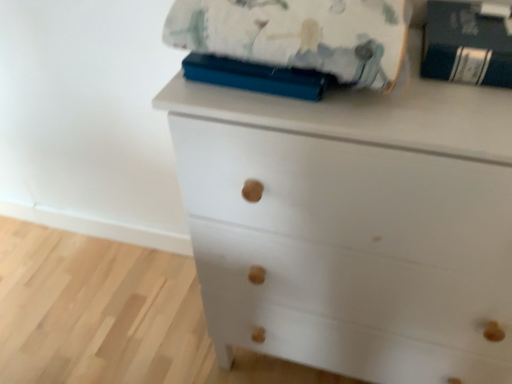
This screenshot has width=512, height=384. I want to click on fluffy cotton blanket at upper center, so [x=301, y=35].

Describe the element at coordinates (465, 46) in the screenshot. I see `dark blue hardcover book at upper right` at that location.

Image resolution: width=512 pixels, height=384 pixels. In order to click on white matte chest of drawers at center in this screenshot , I will do `click(353, 225)`.

From the picture: Which of these two, dark blue hardcover book at upper right or fluffy cotton blanket at upper center, stands shorter?

With less height is dark blue hardcover book at upper right.

From the image's perspective, who appears lower, dark blue hardcover book at upper right or fluffy cotton blanket at upper center?

dark blue hardcover book at upper right is shown below in the image.

Is dark blue hardcover book at upper right placed right next to fluffy cotton blanket at upper center?

No, dark blue hardcover book at upper right is not making contact with fluffy cotton blanket at upper center.

Between dark blue hardcover book at upper right and fluffy cotton blanket at upper center, which one has smaller width?

dark blue hardcover book at upper right is thinner.

How many degrees apart are the facing directions of white matte chest of drawers at center and dark blue hardcover book at upper right?

There is a 0.000221-degree angle between the facing directions of white matte chest of drawers at center and dark blue hardcover book at upper right.

Between white matte chest of drawers at center and dark blue hardcover book at upper right, which one is positioned in front?

white matte chest of drawers at center.

Is white matte chest of drawers at center next to dark blue hardcover book at upper right?

No.

Does point (385, 373) come closer to viewer compared to point (443, 78)?

No, it is behind (443, 78).

Can you confirm if dark blue hardcover book at upper right is positioned to the left of white matte chest of drawers at center?

No, dark blue hardcover book at upper right is not to the left of white matte chest of drawers at center.

Are dark blue hardcover book at upper right and white matte chest of drawers at center located far from each other?

That's not correct — dark blue hardcover book at upper right is a little close to white matte chest of drawers at center.

Which is closer, (455, 23) or (348, 100)?

Point (348, 100)

In terms of width, does dark blue hardcover book at upper right look wider or thinner when compared to white matte chest of drawers at center?

dark blue hardcover book at upper right is thinner than white matte chest of drawers at center.

Can you confirm if fluffy cotton blanket at upper center is taller than dark blue hardcover book at upper right?

Indeed, fluffy cotton blanket at upper center has a greater height compared to dark blue hardcover book at upper right.

Considering the points (207, 33) and (460, 35), which point is in front, point (207, 33) or point (460, 35)?

Point (207, 33)

Considering the relative sizes of fluffy cotton blanket at upper center and dark blue hardcover book at upper right in the image provided, is fluffy cotton blanket at upper center wider than dark blue hardcover book at upper right?

Indeed, fluffy cotton blanket at upper center has a greater width compared to dark blue hardcover book at upper right.

Can we say fluffy cotton blanket at upper center lies outside dark blue hardcover book at upper right?

Yes, fluffy cotton blanket at upper center is outside of dark blue hardcover book at upper right.

Is white matte chest of drawers at center not inside fluffy cotton blanket at upper center?

Yes, white matte chest of drawers at center is located beyond the bounds of fluffy cotton blanket at upper center.

From their relative heights in the image, would you say white matte chest of drawers at center is taller or shorter than fluffy cotton blanket at upper center?

In the image, white matte chest of drawers at center appears to be taller than fluffy cotton blanket at upper center.

Visually, is white matte chest of drawers at center positioned to the left or to the right of fluffy cotton blanket at upper center?

Clearly, white matte chest of drawers at center is on the right of fluffy cotton blanket at upper center in the image.

From a real-world perspective, is fluffy cotton blanket at upper center physically above white matte chest of drawers at center?

Yes, from a real-world perspective, fluffy cotton blanket at upper center is on top of white matte chest of drawers at center.

In the image, is fluffy cotton blanket at upper center on the left side or the right side of white matte chest of drawers at center?

From the image, it's evident that fluffy cotton blanket at upper center is to the left of white matte chest of drawers at center.

Is white matte chest of drawers at center surrounded by fluffy cotton blanket at upper center?

No, white matte chest of drawers at center is located outside of fluffy cotton blanket at upper center.

You are a GUI agent. You are given a task and a screenshot of the screen. Output one action in this format:
    pyautogui.click(x=<x>, y=<y>)
    Task: Click on the blanket that appears above the white matte chest of drawers at center (from the image's perspective)
    This screenshot has height=384, width=512.
    Given the screenshot: What is the action you would take?
    pyautogui.click(x=301, y=35)

I want to click on paperback book that is behind the fluffy cotton blanket at upper center, so click(x=465, y=46).

What are the coordinates of `paperback book above the white matte chest of drawers at center (from a real-world perspective)` in the screenshot? It's located at point(465,46).

Considering their positions, is dark blue hardcover book at upper right positioned closer to fluffy cotton blanket at upper center than white matte chest of drawers at center?

Based on the image, dark blue hardcover book at upper right appears to be nearer to fluffy cotton blanket at upper center.

In the scene shown: Which object lies nearer to the anchor point white matte chest of drawers at center, dark blue hardcover book at upper right or fluffy cotton blanket at upper center?

The object closer to white matte chest of drawers at center is fluffy cotton blanket at upper center.

Based on their spatial positions, is fluffy cotton blanket at upper center or white matte chest of drawers at center further from dark blue hardcover book at upper right?

white matte chest of drawers at center.

Considering their positions, is fluffy cotton blanket at upper center positioned further to white matte chest of drawers at center than dark blue hardcover book at upper right?

The object further to white matte chest of drawers at center is dark blue hardcover book at upper right.

Looking at the image, which one is located further to fluffy cotton blanket at upper center, white matte chest of drawers at center or dark blue hardcover book at upper right?

Based on the image, white matte chest of drawers at center appears to be further to fluffy cotton blanket at upper center.

From the image, which object appears to be nearer to dark blue hardcover book at upper right, white matte chest of drawers at center or fluffy cotton blanket at upper center?

fluffy cotton blanket at upper center is positioned closer to the anchor dark blue hardcover book at upper right.

At what (x,y) coordinates should I click in order to perform the action: click on paperback book between fluffy cotton blanket at upper center and white matte chest of drawers at center vertically. Please return your answer as a coordinate pair (x, y). The image size is (512, 384). Looking at the image, I should click on (465, 46).